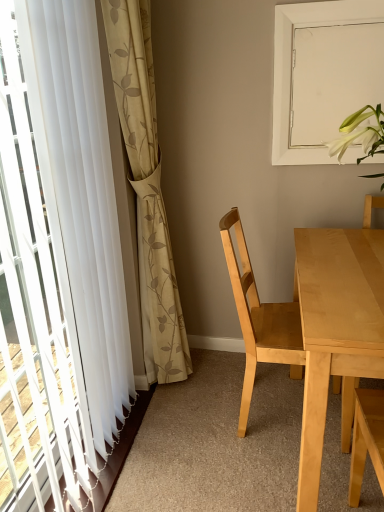
Question: In terms of width, does white matte window screen at upper right look wider or thinner when compared to light wood chair at center?

Choices:
 (A) thin
 (B) wide

Answer: (A)

Question: From the image's perspective, relative to light wood chair at center, is white matte window screen at upper right above or below?

Choices:
 (A) below
 (B) above

Answer: (B)

Question: Which object is the farthest from the light wood table at right?

Choices:
 (A) white matte window screen at upper right
 (B) beige floral fabric curtain at left, which appears as the first curtain when viewed from the right
 (C) white sheer curtain at left, the 1th curtain in the left-to-right sequence
 (D) light wood chair at center

Answer: (C)

Question: Which object is positioned farthest from the white matte window screen at upper right?

Choices:
 (A) white sheer curtain at left, the 1th curtain in the left-to-right sequence
 (B) beige floral fabric curtain at left, positioned as the second curtain in left-to-right order
 (C) light wood chair at center
 (D) light wood table at right

Answer: (A)